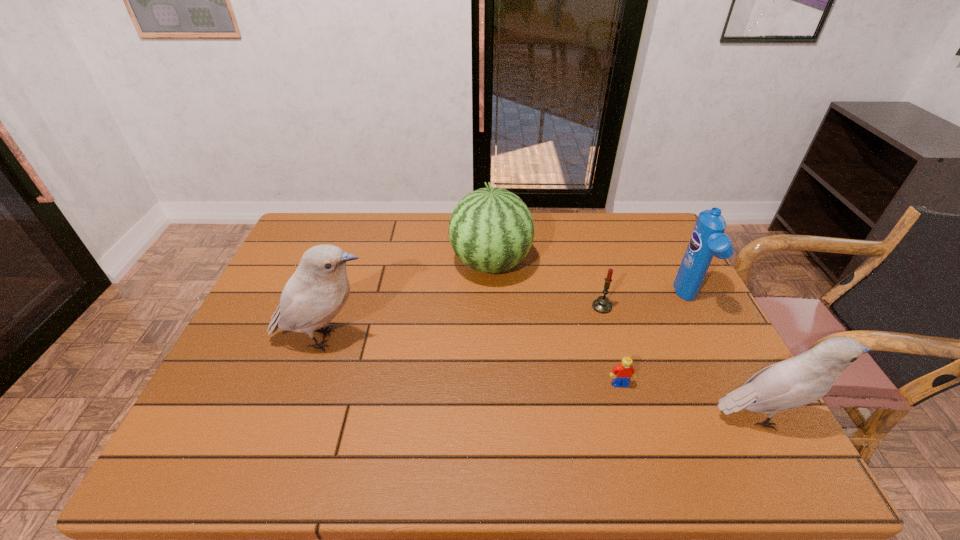
Locate an element on the screen. The image size is (960, 540). vacant region located on the left of the candle is located at coordinates (531, 307).

Locate an element on the screen. This screenshot has height=540, width=960. vacant region located 0.400m on the right of the second object from left to right is located at coordinates (660, 264).

The height and width of the screenshot is (540, 960). In order to click on vacant space located on the back of the shampoo in this screenshot , I will do (648, 220).

Where is `free space located 0.060m on the face of the Lego`? The image size is (960, 540). free space located 0.060m on the face of the Lego is located at coordinates (628, 410).

The image size is (960, 540). Identify the location of object situated at the far edge. (491, 230).

I want to click on object that is at the near edge, so click(800, 380).

Where is `object situated at the left edge`? object situated at the left edge is located at coordinates (313, 296).

Image resolution: width=960 pixels, height=540 pixels. Find the location of `bird that is at the right edge`. bird that is at the right edge is located at coordinates (800, 380).

Locate an element on the screen. This screenshot has height=540, width=960. shampoo that is positioned at the right edge is located at coordinates (707, 240).

The width and height of the screenshot is (960, 540). I want to click on object at the near right corner, so click(x=800, y=380).